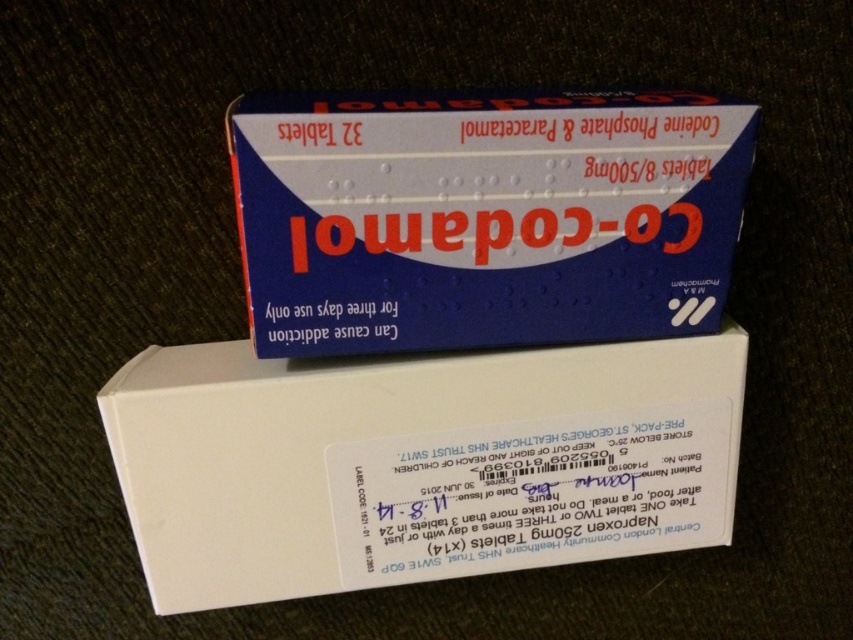
Question: Does white cardboard box at center appear on the right side of blue cardboard box at upper center?

Choices:
 (A) no
 (B) yes

Answer: (A)

Question: Which point is farther to the camera?

Choices:
 (A) blue cardboard box at upper center
 (B) white cardboard box at center

Answer: (B)

Question: Does white cardboard box at center have a lesser width compared to blue cardboard box at upper center?

Choices:
 (A) no
 (B) yes

Answer: (A)

Question: Which of the following is the closest to the observer?

Choices:
 (A) white cardboard box at center
 (B) blue cardboard box at upper center

Answer: (B)

Question: Which object is farther from the camera taking this photo?

Choices:
 (A) blue cardboard box at upper center
 (B) white cardboard box at center

Answer: (B)

Question: Does white cardboard box at center lie behind blue cardboard box at upper center?

Choices:
 (A) no
 (B) yes

Answer: (B)